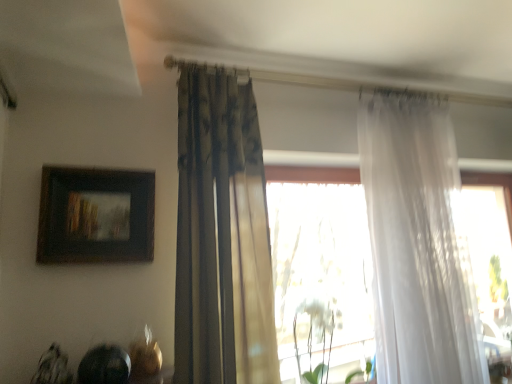
Question: Considering the relative sizes of translucent white curtain at right, the second curtain viewed from the left, and wooden framed painting at upper left in the image provided, is translucent white curtain at right, the second curtain viewed from the left, bigger than wooden framed painting at upper left?

Choices:
 (A) yes
 (B) no

Answer: (A)

Question: Is translucent white curtain at right, the 1th curtain in the right-to-left sequence, far away from wooden framed painting at upper left?

Choices:
 (A) yes
 (B) no

Answer: (A)

Question: From the image's perspective, does translucent white curtain at right, the 1th curtain in the right-to-left sequence, appear higher than wooden framed painting at upper left?

Choices:
 (A) yes
 (B) no

Answer: (B)

Question: Is translucent white curtain at right, the second curtain viewed from the left, outside wooden framed painting at upper left?

Choices:
 (A) yes
 (B) no

Answer: (A)

Question: Is translucent white curtain at right, the 1th curtain in the right-to-left sequence, thinner than wooden framed painting at upper left?

Choices:
 (A) no
 (B) yes

Answer: (A)

Question: From the image's perspective, is translucent white curtain at right, the second curtain viewed from the left, located above or below wooden framed painting at upper left?

Choices:
 (A) below
 (B) above

Answer: (A)

Question: Looking at their shapes, would you say translucent white curtain at right, the second curtain viewed from the left, is wider or thinner than wooden framed painting at upper left?

Choices:
 (A) thin
 (B) wide

Answer: (B)

Question: Is translucent white curtain at right, the second curtain viewed from the left, in front of or behind wooden framed painting at upper left in the image?

Choices:
 (A) front
 (B) behind

Answer: (B)

Question: From a real-world perspective, is translucent white curtain at right, the second curtain viewed from the left, above or below wooden framed painting at upper left?

Choices:
 (A) above
 (B) below

Answer: (B)

Question: Is wooden framed painting at upper left inside the boundaries of translucent white curtain at right, the 1th curtain in the right-to-left sequence, or outside?

Choices:
 (A) outside
 (B) inside

Answer: (A)

Question: Considering the positions of wooden framed painting at upper left and translucent white curtain at right, the 1th curtain in the right-to-left sequence, in the image, is wooden framed painting at upper left wider or thinner than translucent white curtain at right, the 1th curtain in the right-to-left sequence,?

Choices:
 (A) wide
 (B) thin

Answer: (B)

Question: Based on their sizes in the image, would you say wooden framed painting at upper left is bigger or smaller than translucent white curtain at right, the 1th curtain in the right-to-left sequence?

Choices:
 (A) big
 (B) small

Answer: (B)

Question: From the image's perspective, is wooden framed painting at upper left located above or below translucent white curtain at right, the 1th curtain in the right-to-left sequence?

Choices:
 (A) above
 (B) below

Answer: (A)

Question: Which is correct: white matte plant at center is inside translucent white curtain at right, the second curtain viewed from the left, or outside of it?

Choices:
 (A) inside
 (B) outside

Answer: (B)

Question: Relative to translucent white curtain at right, the second curtain viewed from the left, is white matte plant at center in front or behind?

Choices:
 (A) front
 (B) behind

Answer: (B)